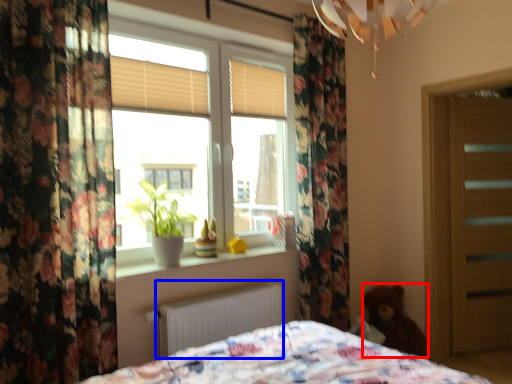
Question: Which object is further to the camera taking this photo, teddy (highlighted by a red box) or radiator (highlighted by a blue box)?

Choices:
 (A) teddy
 (B) radiator

Answer: (A)